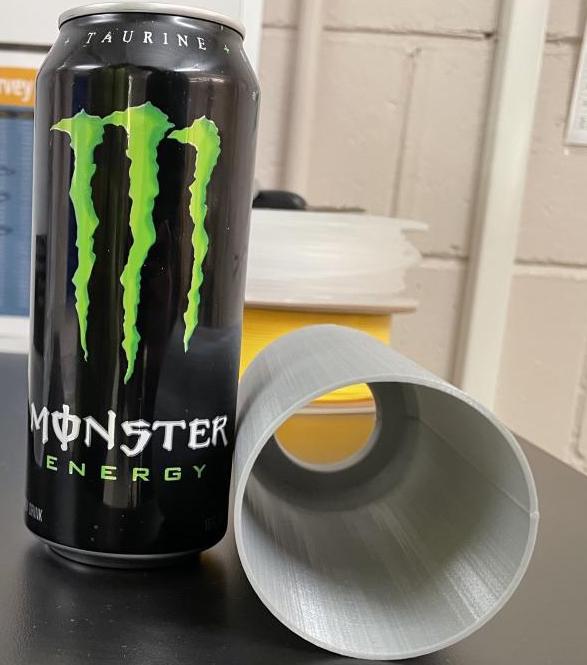
Locate an element on the screen. The height and width of the screenshot is (665, 587). white poster is located at coordinates (575, 132).